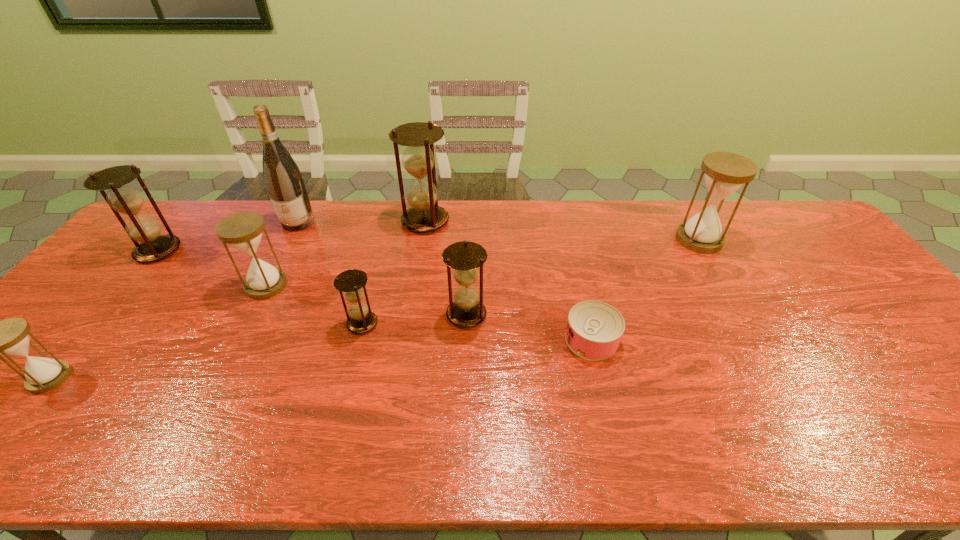
The width and height of the screenshot is (960, 540). What are the coordinates of `free space between the brown wine bottle and the smallest brown hourglass` in the screenshot? It's located at tap(330, 273).

Choose which object is the seventh nearest neighbor to the shortest object. Please provide its 2D coordinates. Your answer should be formatted as a tuple, i.e. [(x, y)], where the tuple contains the x and y coordinates of a point satisfying the conditions above.

[(122, 198)]

I want to click on object identified as the sixth closest to the third biggest brown hourglass, so click(x=725, y=172).

Where is `hourglass that can be found as the fifth closest to the third nearest brown hourglass`? The width and height of the screenshot is (960, 540). hourglass that can be found as the fifth closest to the third nearest brown hourglass is located at coordinates (466, 310).

You are a GUI agent. You are given a task and a screenshot of the screen. Output one action in this format:
    pyautogui.click(x=<x>, y=<y>)
    Task: Click on the hourglass that stands as the third closest to the rightmost hourglass
    This screenshot has width=960, height=540.
    Given the screenshot: What is the action you would take?
    pyautogui.click(x=352, y=282)

Where is `the third closest brown hourglass to the second biggest brown hourglass`? the third closest brown hourglass to the second biggest brown hourglass is located at coordinates (466, 310).

You are a GUI agent. You are given a task and a screenshot of the screen. Output one action in this format:
    pyautogui.click(x=<x>, y=<y>)
    Task: Click on the closest brown hourglass to the brown wine bottle
    This screenshot has width=960, height=540.
    Given the screenshot: What is the action you would take?
    pyautogui.click(x=122, y=198)

Locate an element on the screen. The height and width of the screenshot is (540, 960). white hourglass that is the second closest to the third nearest brown hourglass is located at coordinates (11, 337).

Where is `the second closest white hourglass to the third smallest brown hourglass`? The image size is (960, 540). the second closest white hourglass to the third smallest brown hourglass is located at coordinates (11, 337).

Find the location of `vacant point that satisfies the following two spatial constraints: 1. on the label of the tallest object; 2. on the left side of the fifth hourglass from right to left`. vacant point that satisfies the following two spatial constraints: 1. on the label of the tallest object; 2. on the left side of the fifth hourglass from right to left is located at coordinates (266, 286).